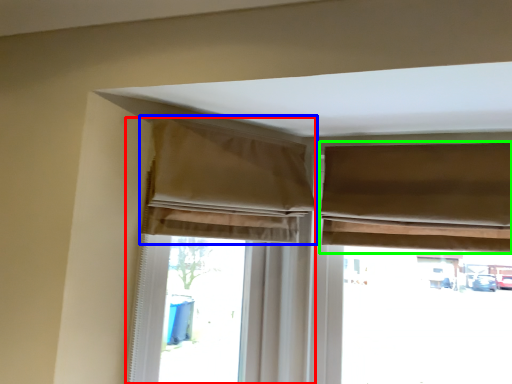
Question: Estimate the real-world distances between objects in this image. Which object is closer to curtain (highlighted by a red box), curtain (highlighted by a blue box) or curtain (highlighted by a green box)?

Choices:
 (A) curtain
 (B) curtain

Answer: (A)